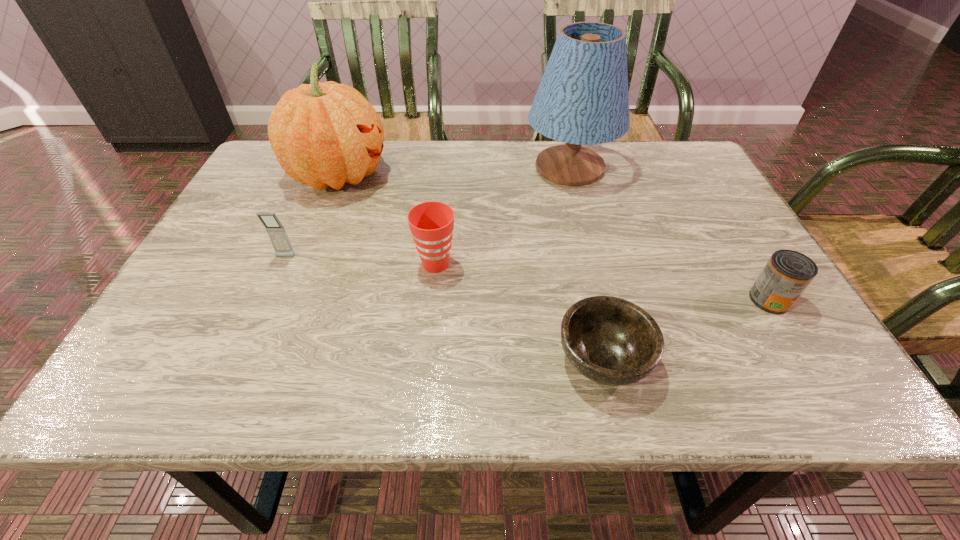
This screenshot has width=960, height=540. Find the location of `free region at the far edge of the desktop`. free region at the far edge of the desktop is located at coordinates (500, 149).

The width and height of the screenshot is (960, 540). Identify the location of vacant space at the near edge of the desktop. (250, 363).

Locate an element on the screen. This screenshot has width=960, height=540. vacant space at the left edge of the desktop is located at coordinates (221, 253).

In the image, there is a desktop. Identify the location of vacant space at the right edge. Image resolution: width=960 pixels, height=540 pixels. (734, 265).

What are the coordinates of `vacant region at the far right corner of the desktop` in the screenshot? It's located at (675, 149).

I want to click on free spot between the tallest object and the bowl, so click(x=587, y=264).

The height and width of the screenshot is (540, 960). Find the location of `empty space that is in between the pumpkin and the second shortest object`. empty space that is in between the pumpkin and the second shortest object is located at coordinates (554, 238).

Locate an element on the screen. The width and height of the screenshot is (960, 540). free spot between the shortest object and the rightmost object is located at coordinates (686, 329).

The height and width of the screenshot is (540, 960). Identify the location of free space between the cup and the pumpkin. (387, 220).

The height and width of the screenshot is (540, 960). What are the coordinates of `vacant space that is in between the fifth shortest object and the nearest object` in the screenshot? It's located at (470, 267).